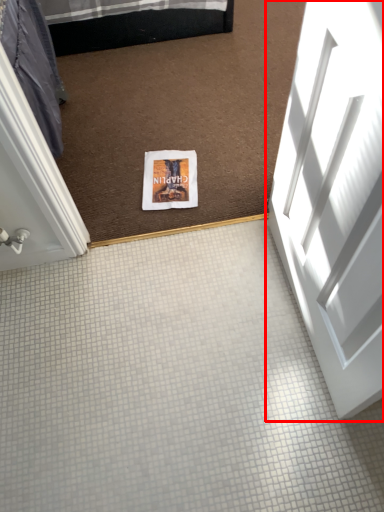
Question: From the image's perspective, where is door (annotated by the red box) located in relation to flyer in the image?

Choices:
 (A) below
 (B) above

Answer: (A)